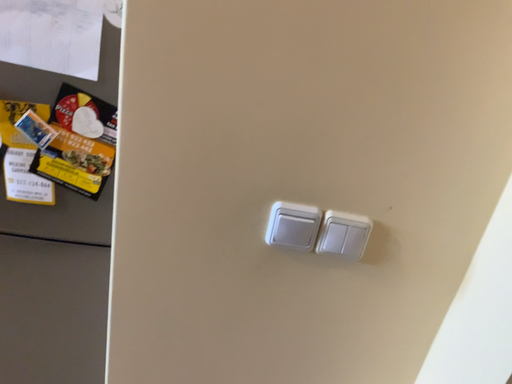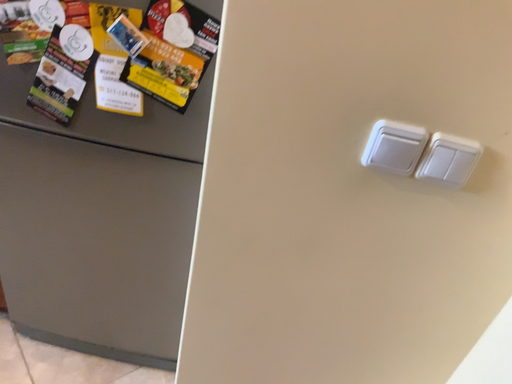
Question: How did the camera likely rotate when shooting the video?

Choices:
 (A) rotated upward
 (B) rotated downward

Answer: (B)